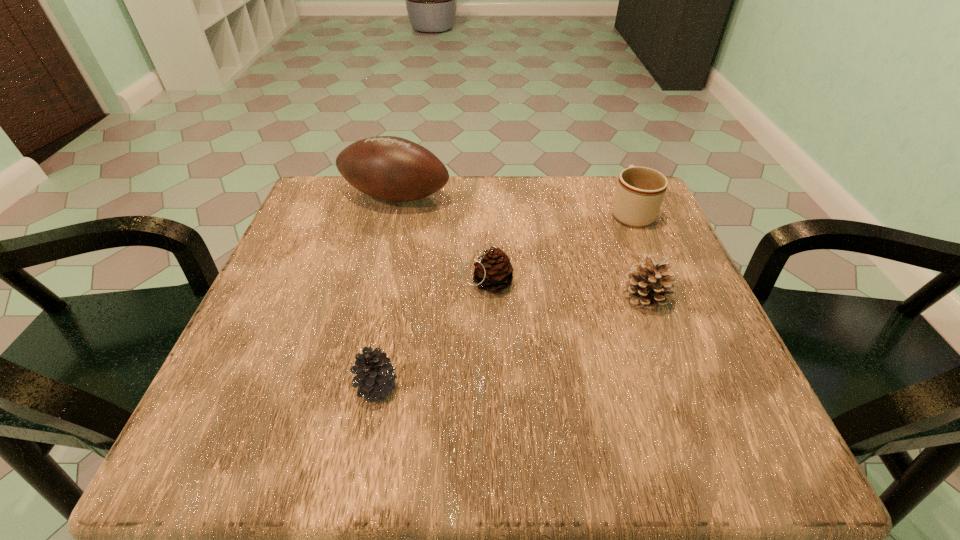
Where is `free space at the near edge of the desktop`? The height and width of the screenshot is (540, 960). free space at the near edge of the desktop is located at coordinates (614, 420).

Locate an element on the screen. This screenshot has width=960, height=540. free spot at the right edge of the desktop is located at coordinates (688, 267).

In the image, there is a desktop. Identify the location of vacant space at the far left corner. This screenshot has height=540, width=960. (313, 197).

Find the location of `vacant region at the far right corner`. vacant region at the far right corner is located at coordinates (656, 221).

This screenshot has width=960, height=540. In order to click on vacant area that lies between the rightmost pinecone and the nearest object in this screenshot , I will do `click(512, 342)`.

Identify the location of free space between the football (American) and the second pinecone from left to right. The height and width of the screenshot is (540, 960). (442, 240).

Identify the location of unoccupied position between the leftmost pinecone and the rightmost pinecone. (512, 342).

You are a GUI agent. You are given a task and a screenshot of the screen. Output one action in this format:
    pyautogui.click(x=<x>, y=<y>)
    Task: Click on the unoccupied area between the football (American) and the rightmost pinecone
    The width and height of the screenshot is (960, 540).
    Given the screenshot: What is the action you would take?
    pyautogui.click(x=520, y=247)

Where is `vacant area that lies between the mug and the leftmost pinecone`? The image size is (960, 540). vacant area that lies between the mug and the leftmost pinecone is located at coordinates (504, 300).

Identify the location of free spot between the third object from left to right and the mug. (560, 247).